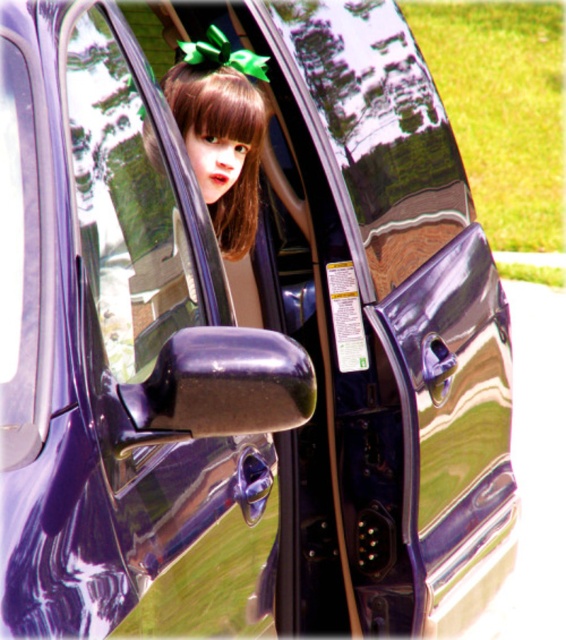
You are a child trying to see the outside world from inside the car. You notice the transparent plastic car window at center and the matte brown hair at center. Which object is closer to you as you look forward?

The transparent plastic car window at center is closer to you than the matte brown hair at center because it is in front of it.

You are a person trying to see the outside world through the transparent plastic car window at center while sitting inside the car. Can you see the entire matte brown hair at center through the window?

The transparent plastic car window at center is much taller than matte brown hair at center, so yes, you can see the entire matte brown hair at center through the window.

You are a delivery person trying to hand a package to someone inside the car through the open passenger side door. The transparent plastic car window at center and the matte brown hair at center are in your line of sight. Which object is narrower in width so you can aim your hand through?

The transparent plastic car window at center is thinner than the matte brown hair at center, so you should aim your hand through the transparent plastic car window at center since it is narrower in width.